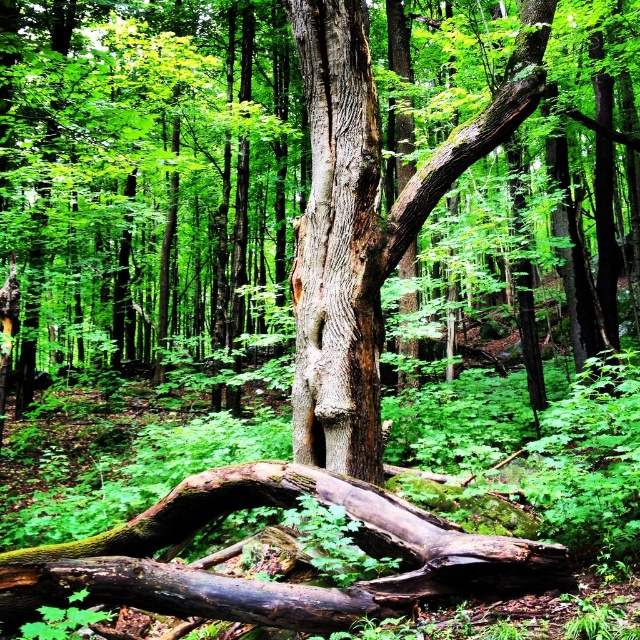
You are a hiker trying to cross the forest and need to step over two obstacles in the center of the image. The obstacles are the brown rough log at center and the smooth brown tree trunk at center. Which obstacle will require a wider step to cross?

The brown rough log at center has a larger width than the smooth brown tree trunk at center, so it will require a wider step to cross.

You are a hiker who needs to cross from the brown rough log at center to the smooth brown tree trunk at center. Can you step directly from one to the other without needing to jump?

The distance between the brown rough log at center and the smooth brown tree trunk at center is 4.36 feet, which is too far to step across without jumping. You would need to jump or find another way to cross.